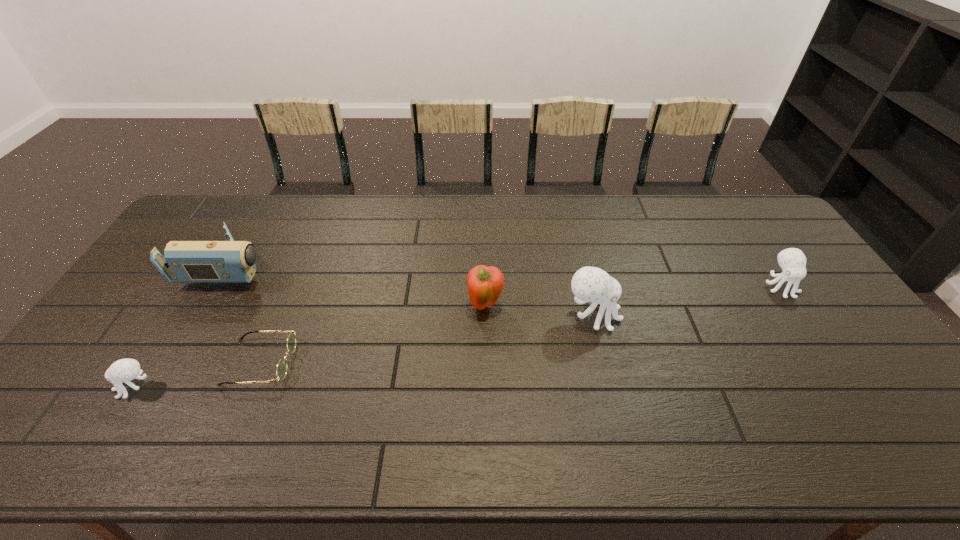
Where is `empty location between the shortest object and the camcorder`? The height and width of the screenshot is (540, 960). empty location between the shortest object and the camcorder is located at coordinates (246, 314).

Find the location of a particular element. This screenshot has height=540, width=960. free spot between the rightmost object and the pepper is located at coordinates (633, 296).

You are a GUI agent. You are given a task and a screenshot of the screen. Output one action in this format:
    pyautogui.click(x=<x>, y=<y>)
    Task: Click on the free space between the third object from right to left and the nearest octopus
    
    Given the screenshot: What is the action you would take?
    pyautogui.click(x=310, y=346)

In order to click on free space between the camcorder and the second octopus from right to left in this screenshot , I will do pos(412,291).

Where is `vacant area that lies between the spectacles and the camcorder`? vacant area that lies between the spectacles and the camcorder is located at coordinates [246, 314].

In order to click on free space that is in between the nearest octopus and the third object from right to left in this screenshot , I will do pos(310,346).

Identify the location of vacant region between the pepper and the tallest octopus. The image size is (960, 540). (540, 310).

Point out which object is positioned as the second nearest to the rightmost octopus. Please provide its 2D coordinates. Your answer should be formatted as a tuple, i.e. [(x, y)], where the tuple contains the x and y coordinates of a point satisfying the conditions above.

[(485, 284)]

The image size is (960, 540). Find the location of `object that is the third closest to the shortest object`. object that is the third closest to the shortest object is located at coordinates (485, 284).

Where is `octopus that stands as the closest to the pepper`? octopus that stands as the closest to the pepper is located at coordinates (589, 284).